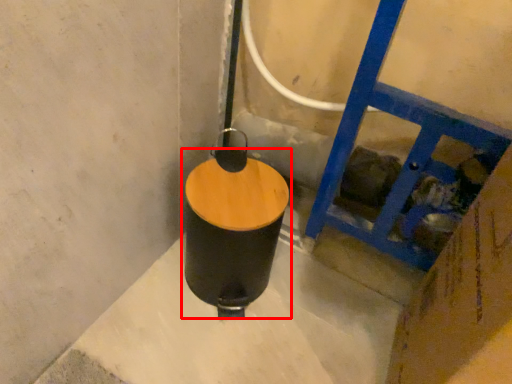
Question: Considering the relative positions of waste container (annotated by the red box) and ladder in the image provided, where is waste container (annotated by the red box) located with respect to the staircase?

Choices:
 (A) left
 (B) right

Answer: (A)